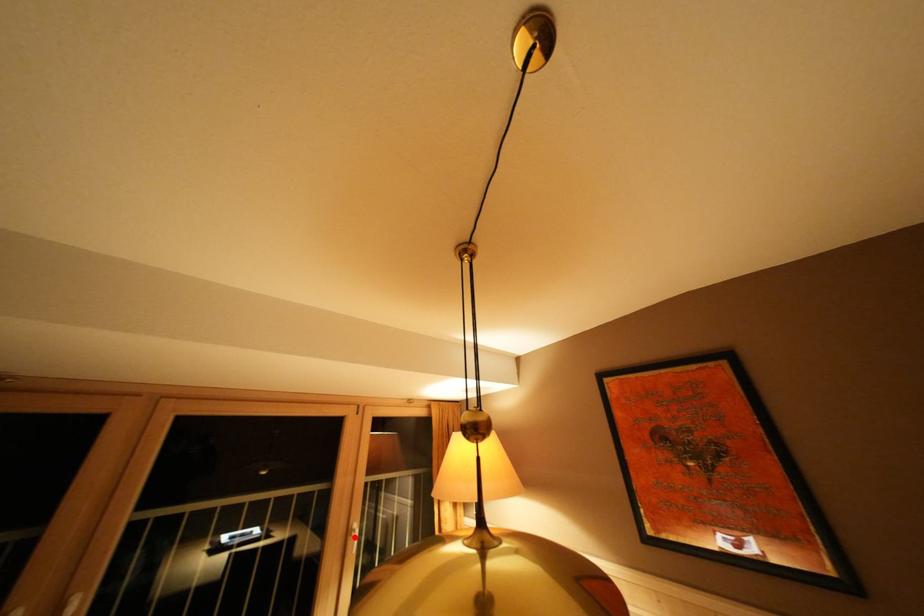
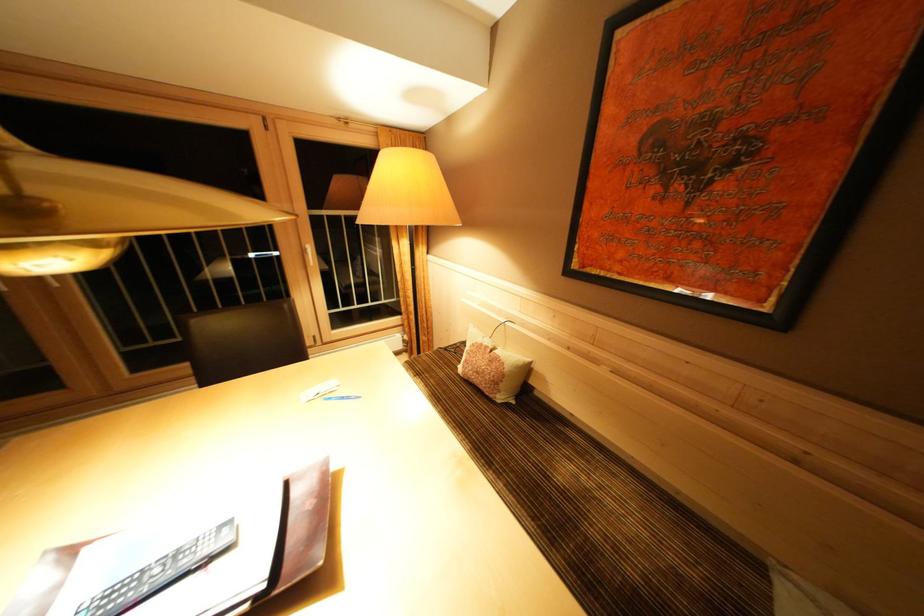
Question: A red point is marked in image1. In image2, is the corresponding 3D point closer to the camera or farther? Reply with the corresponding letter.

Choices:
 (A) The corresponding 3D point is closer.
 (B) The corresponding 3D point is farther.

Answer: (A)